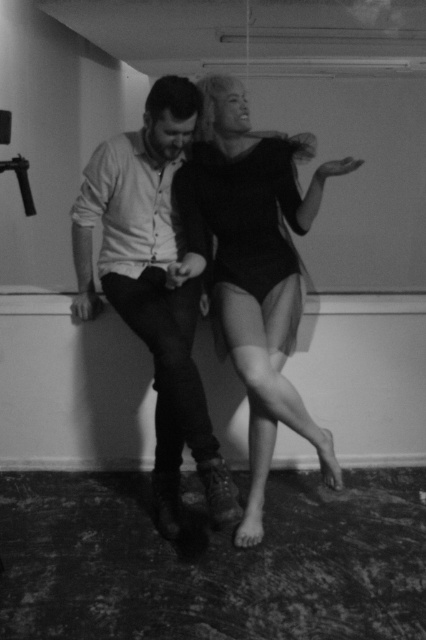
Does point (236, 145) come in front of point (247, 164)?

No, (236, 145) is further to viewer.

Who is more forward, (236, 88) or (178, 218)?

Point (236, 88) is more forward.

This screenshot has height=640, width=426. Find the location of `smooth black bodysuit at center`. smooth black bodysuit at center is located at coordinates (252, 268).

Between point (172, 387) and point (279, 208), which one is positioned in front?

Point (172, 387) is more forward.

Identify the location of matte white shirt at center. (152, 288).

Does smooth black bodysuit at center appear under matte white shirt at center?

Actually, smooth black bodysuit at center is above matte white shirt at center.

This screenshot has height=640, width=426. Identify the location of smooth black bodysuit at center. (252, 268).